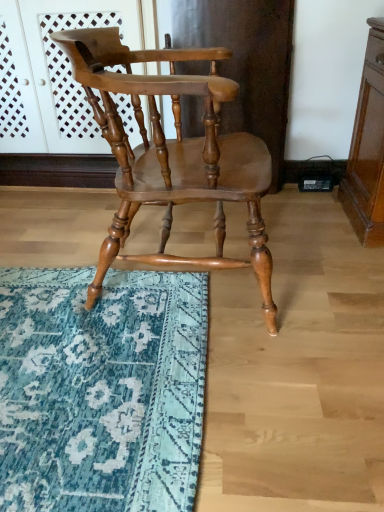
Question: Can you confirm if shiny brown wood chair at center is smaller than matte wood screen door at upper center?

Choices:
 (A) yes
 (B) no

Answer: (A)

Question: From a real-world perspective, is shiny brown wood chair at center on top of matte wood screen door at upper center?

Choices:
 (A) yes
 (B) no

Answer: (B)

Question: Considering the relative sizes of shiny brown wood chair at center and matte wood screen door at upper center in the image provided, is shiny brown wood chair at center taller than matte wood screen door at upper center?

Choices:
 (A) yes
 (B) no

Answer: (B)

Question: Is shiny brown wood chair at center oriented towards matte wood screen door at upper center?

Choices:
 (A) no
 (B) yes

Answer: (A)

Question: Can you confirm if shiny brown wood chair at center is wider than matte wood screen door at upper center?

Choices:
 (A) no
 (B) yes

Answer: (B)

Question: Considering the relative positions of shiny brown wood chair at center and matte wood screen door at upper center in the image provided, is shiny brown wood chair at center in front of matte wood screen door at upper center?

Choices:
 (A) no
 (B) yes

Answer: (B)

Question: Can you confirm if shiny brown wood chair at center is wider than teal rug at lower left?

Choices:
 (A) yes
 (B) no

Answer: (B)

Question: Would you say teal rug at lower left is part of shiny brown wood chair at center's contents?

Choices:
 (A) no
 (B) yes

Answer: (A)

Question: From a real-world perspective, does shiny brown wood chair at center sit lower than teal rug at lower left?

Choices:
 (A) no
 (B) yes

Answer: (A)

Question: Is shiny brown wood chair at center directly adjacent to teal rug at lower left?

Choices:
 (A) no
 (B) yes

Answer: (A)

Question: Can you confirm if shiny brown wood chair at center is thinner than teal rug at lower left?

Choices:
 (A) no
 (B) yes

Answer: (B)

Question: Is shiny brown wood chair at center bigger than teal rug at lower left?

Choices:
 (A) no
 (B) yes

Answer: (B)

Question: Is matte wood screen door at upper center positioned beyond the bounds of teal rug at lower left?

Choices:
 (A) no
 (B) yes

Answer: (B)